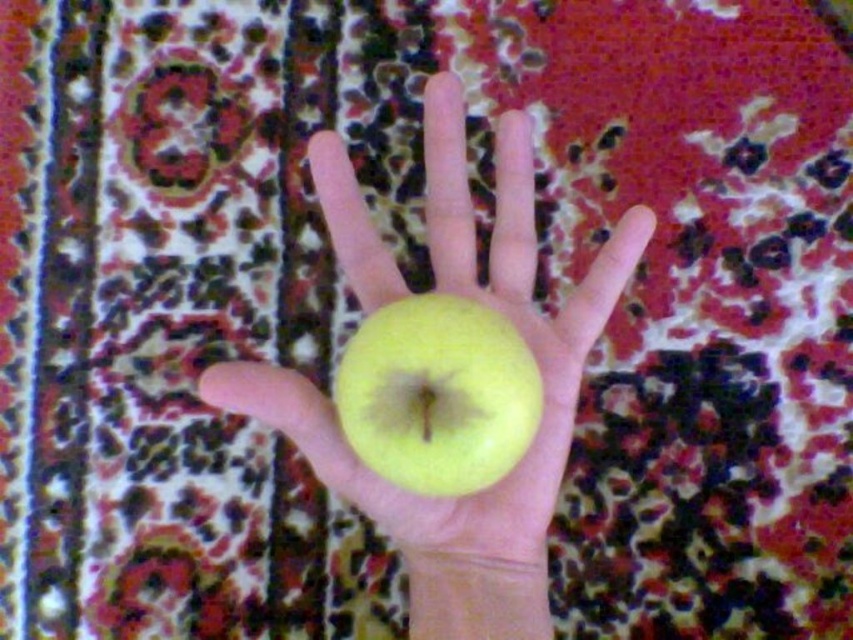
You have a small box that can only fit one apple. If you want to place both the yellow matte apple at center and the green matte apple at center into the box, will they fit together?

The distance between the yellow matte apple at center and the green matte apple at center is 4.60 inches. Since the box can only fit one apple, placing both would require at least the combined size of both apples. However, the given distance between them doesn

You are standing in front of the hand holding the green apple with a brown core in its palm. You notice two points marked on the carpet in the background. The first point is at coordinates point (611, 296) and the second at point (460, 465). From your perspective, which point is closer to you?

Point (460, 465) is closer to you because it is in front of point (611, 296) according to their spatial arrangement.

Looking at this image, you are an apple vendor who needs to display two apples in a showcase. The showcase has a height limit of 10 cm. You have a yellow matte apple at center and a green matte apple at center. Which apple is more likely to exceed the height limit?

The yellow matte apple at center is much taller than the green matte apple at center, so it is more likely to exceed the height limit of 10 cm.